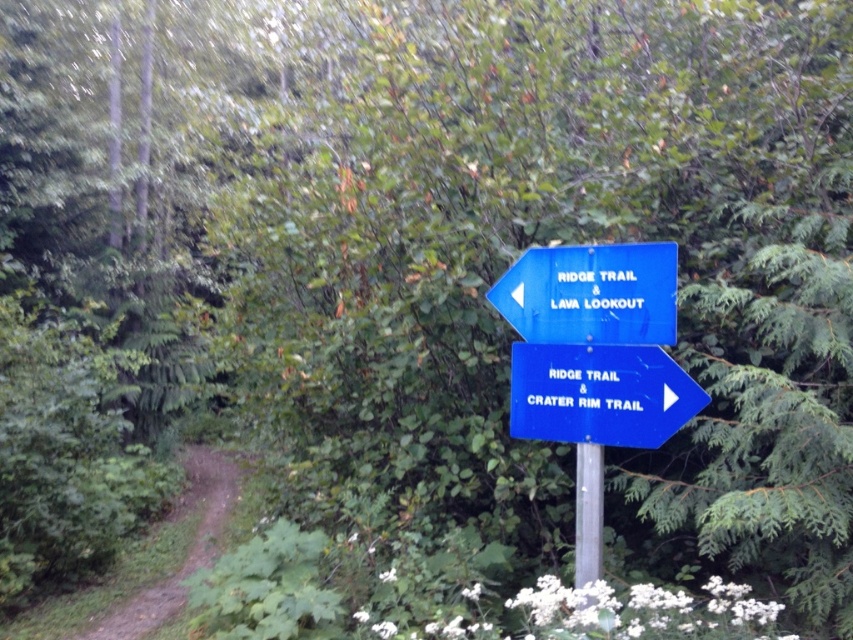
Between blue plastic sign at upper right and white plastic arrow at center right, which one has less height?

white plastic arrow at center right is shorter.

This screenshot has height=640, width=853. Identify the location of blue plastic sign at upper right. (592, 294).

Locate an element on the screen. The width and height of the screenshot is (853, 640). blue plastic sign at center is located at coordinates (598, 394).

In the scene shown: Is blue plastic sign at center thinner than blue plastic arrow at upper center?

Incorrect, blue plastic sign at center's width is not less than blue plastic arrow at upper center's.

Which is in front, point (514, 429) or point (518, 296)?

Point (518, 296) is more forward.

At what (x,y) coordinates should I click in order to perform the action: click on blue plastic sign at center. Please return your answer as a coordinate pair (x, y). This screenshot has width=853, height=640. Looking at the image, I should click on (598, 394).

Which is in front, point (680, 387) or point (515, 304)?

Point (680, 387) is more forward.

Does blue plastic sign at center come behind blue plastic sign at upper right?

That is False.

Between point (578, 372) and point (590, 253), which one is positioned behind?

Positioned behind is point (578, 372).

The width and height of the screenshot is (853, 640). I want to click on blue plastic sign at center, so click(598, 394).